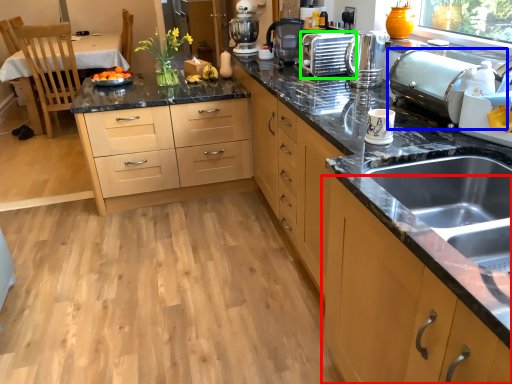
Question: Considering the real-world distances, which object is farthest from cabinetry (highlighted by a red box)? appliance (highlighted by a blue box) or appliance (highlighted by a green box)?

Choices:
 (A) appliance
 (B) appliance

Answer: (B)